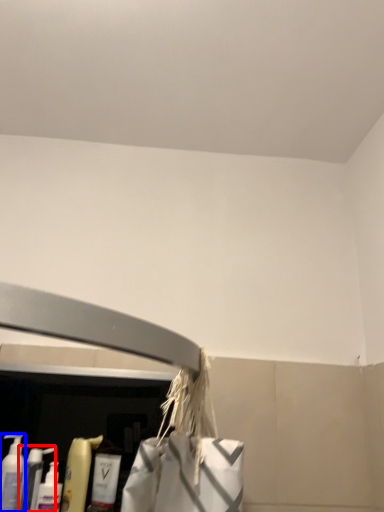
Question: Which of the following is the farthest to the observer, cleaning product (highlighted by a red box) or cleaning product (highlighted by a blue box)?

Choices:
 (A) cleaning product
 (B) cleaning product

Answer: (A)